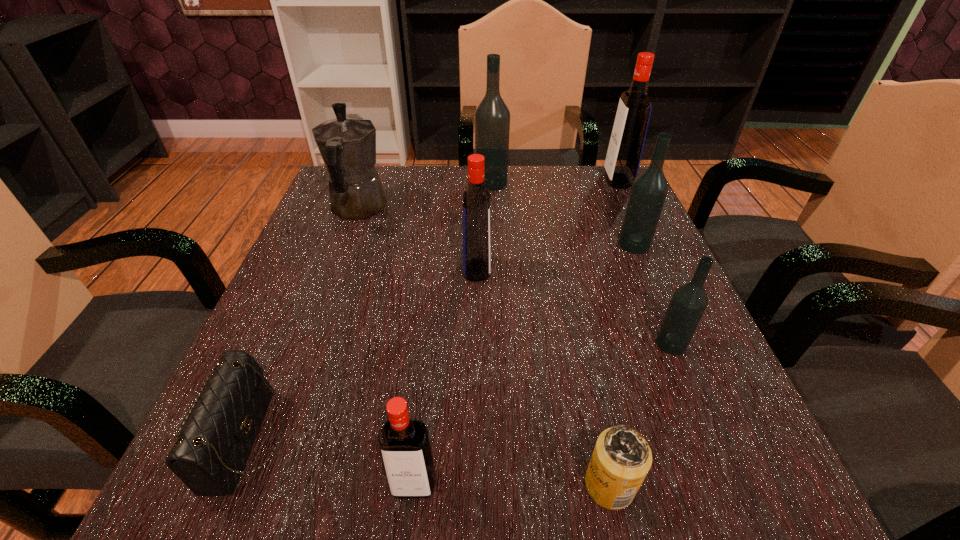
Locate an element on the screen. Image resolution: width=960 pixels, height=540 pixels. the farthest red vodka is located at coordinates (626, 144).

Where is `the rightmost red vodka`? The image size is (960, 540). the rightmost red vodka is located at coordinates (626, 144).

Find the location of a particular element. The height and width of the screenshot is (540, 960). the biggest black vodka is located at coordinates (492, 117).

Find the location of a particular element. Image resolution: width=960 pixels, height=540 pixels. the leftmost black vodka is located at coordinates (492, 117).

At what (x,y) coordinates should I click in order to perform the action: click on coffeepot. Please return your answer as a coordinate pair (x, y). The width and height of the screenshot is (960, 540). Looking at the image, I should click on (347, 144).

Where is `the second biggest black vodka`? The height and width of the screenshot is (540, 960). the second biggest black vodka is located at coordinates pos(649,190).

You are a GUI agent. You are given a task and a screenshot of the screen. Output one action in this format:
    pyautogui.click(x=<x>, y=<y>)
    Task: Click on the fourth nearest vodka
    
    Given the screenshot: What is the action you would take?
    pyautogui.click(x=649, y=190)

You are a GUI agent. You are given a task and a screenshot of the screen. Output one action in this format:
    pyautogui.click(x=<x>, y=<y>)
    Task: Click on the second red vodka from left to right
    This screenshot has height=540, width=960.
    Given the screenshot: What is the action you would take?
    pyautogui.click(x=476, y=202)

Where is `the fourth farthest vodka`? The width and height of the screenshot is (960, 540). the fourth farthest vodka is located at coordinates (476, 202).

Where is `the nearest black vodka`? the nearest black vodka is located at coordinates (688, 303).